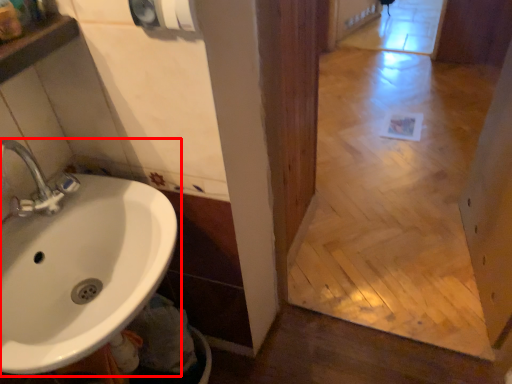
Question: From the image's perspective, where is sink (annotated by the red box) located relative to hand dryer?

Choices:
 (A) below
 (B) above

Answer: (A)